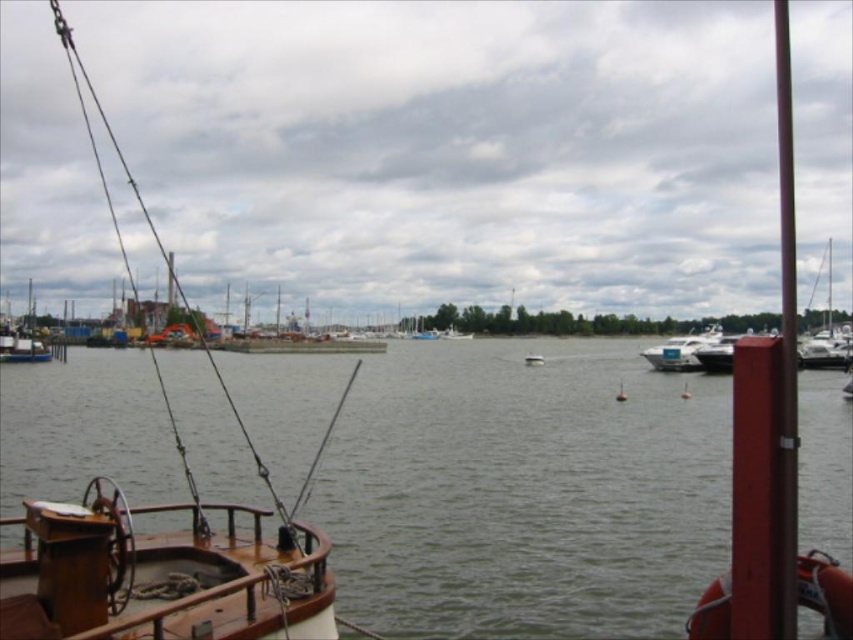
Is white glossy sailboat at right taller than white glossy boat at center?

Correct, white glossy sailboat at right is much taller as white glossy boat at center.

Where is `white glossy sailboat at right`? This screenshot has width=853, height=640. white glossy sailboat at right is located at coordinates (827, 328).

Identify the location of white glossy sailboat at right. This screenshot has height=640, width=853. (827, 328).

Does greenish water at center have a greater height compared to white glossy motorboat at center-right?

Yes.

Who is positioned more to the right, greenish water at center or white glossy motorboat at center-right?

white glossy motorboat at center-right is more to the right.

Does point (695, 388) come farther from viewer compared to point (701, 365)?

No, it is not.

You are a GUI agent. You are given a task and a screenshot of the screen. Output one action in this format:
    pyautogui.click(x=<x>, y=<y>)
    Task: Click on the greenish water at center
    
    Given the screenshot: What is the action you would take?
    pyautogui.click(x=525, y=490)

Does greenish water at center have a lesser height compared to white plastic boat at center?

No.

Is point (32, 417) positioned in front of point (445, 330)?

Yes.

You are a GUI agent. You are given a task and a screenshot of the screen. Output one action in this format:
    pyautogui.click(x=<x>, y=<y>)
    Task: Click on the greenish water at center
    The width and height of the screenshot is (853, 640).
    Given the screenshot: What is the action you would take?
    pyautogui.click(x=525, y=490)